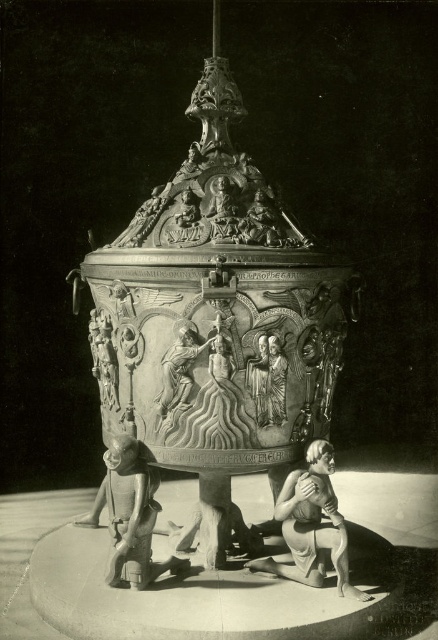
You are a photographer standing in front of the polished bronze baptismal font at center. You want to capture a closeup shot of the crown ornament on its lid. Given that your camera has a minimum focusing distance of 1 meter, will you be able to achieve this without moving closer?

The distance between the polished bronze baptismal font at center and the camera is 1.17 meters. Since the camera requires a minimum focusing distance of 1 meter, you can take the closeup shot without moving closer as the current distance exceeds the required minimum.

You are a restoration artist working on a historical artifact. You need to move a small tool from the polished bronze baptismal font at center to the polished bronze figure at lower left. Given that the tool is 0.5 inches wide, will it fit through the space between them?

The distance between the polished bronze baptismal font at center and the polished bronze figure at lower left is 7.33 inches. Since the tool is only 0.5 inches wide, it will easily fit through the space between them.

You are an art restorer examining the baptismal font. You notice two points on the font labeled as point 1 at coordinate (x=141, y=580) and point 2 at coordinate (x=186, y=332). Which point is closer to you when you are standing in front of the font?

Point 1 at coordinate (x=141, y=580) is closer to you than point 2 at coordinate (x=186, y=332) because it is further to the viewer.